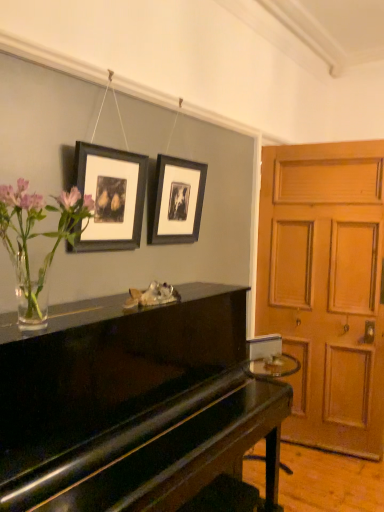
Question: Should I look upward or downward to see black matte picture frame at upper center, the first picture frame in the back-to-front sequence?

Choices:
 (A) down
 (B) up

Answer: (B)

Question: Considering the relative sizes of matte black picture frame at upper center, the 1th picture frame viewed from the left, and black matte picture frame at upper center, which appears as the 2th picture frame when viewed from the left, in the image provided, is matte black picture frame at upper center, the 1th picture frame viewed from the left, shorter than black matte picture frame at upper center, which appears as the 2th picture frame when viewed from the left,?

Choices:
 (A) yes
 (B) no

Answer: (B)

Question: From the image's perspective, does matte black picture frame at upper center, the first picture frame when ordered from front to back, appear lower than black matte picture frame at upper center, the 2th picture frame when ordered from front to back?

Choices:
 (A) no
 (B) yes

Answer: (B)

Question: Is matte black picture frame at upper center, the first picture frame when ordered from front to back, smaller than black matte picture frame at upper center, arranged as the 1th picture frame when viewed from the right?

Choices:
 (A) no
 (B) yes

Answer: (B)

Question: Is matte black picture frame at upper center, the 1th picture frame viewed from the left, not within black matte picture frame at upper center, the 2th picture frame when ordered from front to back?

Choices:
 (A) yes
 (B) no

Answer: (A)

Question: From a real-world perspective, is matte black picture frame at upper center, positioned as the 2th picture frame in back-to-front order, positioned under black matte picture frame at upper center, the first picture frame in the back-to-front sequence, based on gravity?

Choices:
 (A) yes
 (B) no

Answer: (A)

Question: Are matte black picture frame at upper center, positioned as the second picture frame in right-to-left order, and black matte picture frame at upper center, arranged as the 1th picture frame when viewed from the right, beside each other?

Choices:
 (A) no
 (B) yes

Answer: (A)

Question: Considering the relative sizes of clear glass vase with flowers at left and wooden door at right in the image provided, is clear glass vase with flowers at left smaller than wooden door at right?

Choices:
 (A) yes
 (B) no

Answer: (A)

Question: Is wooden door at right inside clear glass vase with flowers at left?

Choices:
 (A) no
 (B) yes

Answer: (A)

Question: Is clear glass vase with flowers at left to the right of wooden door at right from the viewer's perspective?

Choices:
 (A) yes
 (B) no

Answer: (B)

Question: Is clear glass vase with flowers at left facing away from wooden door at right?

Choices:
 (A) yes
 (B) no

Answer: (B)

Question: From a real-world perspective, is clear glass vase with flowers at left physically above wooden door at right?

Choices:
 (A) no
 (B) yes

Answer: (B)

Question: Would you say clear glass vase with flowers at left is outside wooden door at right?

Choices:
 (A) yes
 (B) no

Answer: (A)

Question: Does black matte picture frame at upper center, the first picture frame in the back-to-front sequence, lie behind matte black picture frame at upper center, positioned as the 2th picture frame in back-to-front order?

Choices:
 (A) yes
 (B) no

Answer: (A)